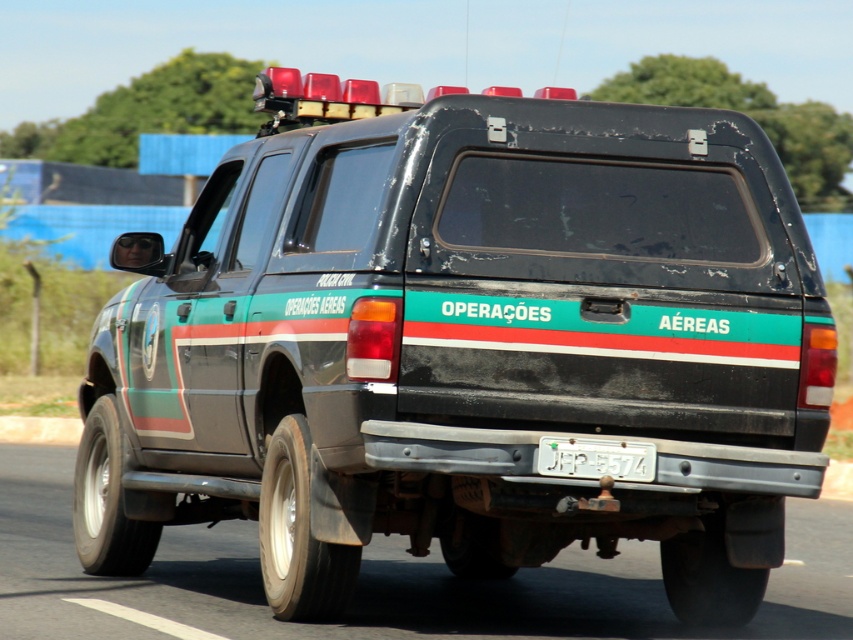
Who is lower down, gray rubber tire at lower center or white plastic license plate at center?

gray rubber tire at lower center is below.

Can you confirm if gray rubber tire at lower center is positioned to the left of white plastic license plate at center?

No, gray rubber tire at lower center is not to the left of white plastic license plate at center.

Between point (245, 609) and point (601, 442), which one is positioned behind?

Point (245, 609)

This screenshot has width=853, height=640. What are the coordinates of `gray rubber tire at lower center` in the screenshot? It's located at (384, 579).